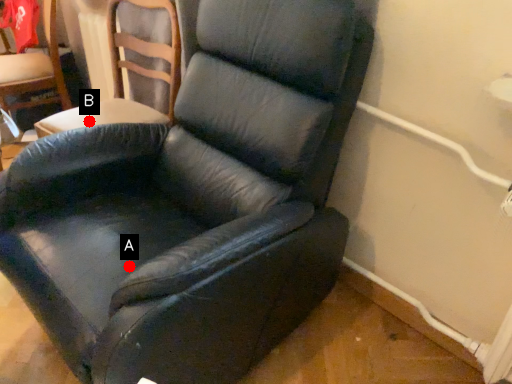
Question: Two points are circled on the image, labeled by A and B beside each circle. Which point is further to the camera?

Choices:
 (A) A is further
 (B) B is further

Answer: (B)